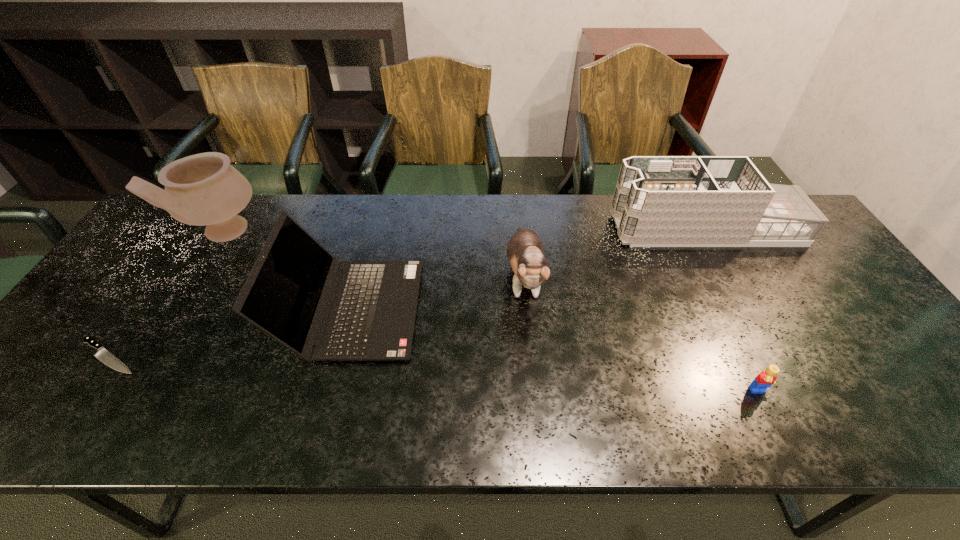
Where is `vacant region between the second shortest object and the tallest object`? The image size is (960, 540). vacant region between the second shortest object and the tallest object is located at coordinates (492, 313).

What are the coordinates of `free space between the cat and the dollhouse` in the screenshot? It's located at (614, 253).

The height and width of the screenshot is (540, 960). Identify the location of vacant space that's between the tallest object and the fourth object from left to right. click(373, 256).

This screenshot has height=540, width=960. I want to click on vacant space that is in between the shortest object and the nearest object, so click(x=434, y=374).

This screenshot has height=540, width=960. What are the coordinates of `unoccupied position between the shortest object and the third object from left to right` in the screenshot? It's located at (230, 333).

Where is `free space between the third object from right to left and the fourth object from right to left`? This screenshot has height=540, width=960. free space between the third object from right to left and the fourth object from right to left is located at coordinates (438, 294).

I want to click on free point between the fourth object from left to right and the dollhouse, so tap(614, 253).

Identify the location of vacant space that's between the cat and the fifth tallest object. The image size is (960, 540). (641, 336).

Locate which object is the fifth closest to the pottery. Please provide its 2D coordinates. Your answer should be formatted as a tuple, i.e. [(x, y)], where the tuple contains the x and y coordinates of a point satisfying the conditions above.

[(765, 379)]

Find the location of a particular element. The image size is (960, 540). object that is the fifth closest to the fourth object from right to left is located at coordinates (765, 379).